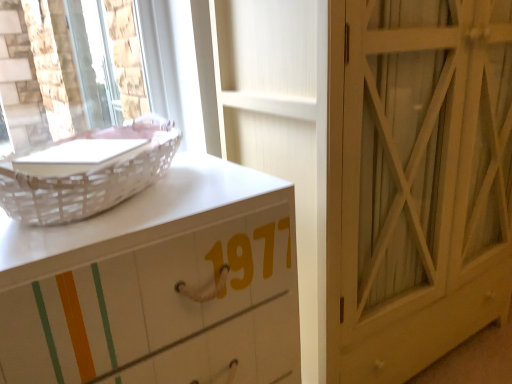
Question: Is white wood door at center-right looking in the opposite direction of white painted wood chest of drawers at left?

Choices:
 (A) yes
 (B) no

Answer: (B)

Question: Is white wood door at center-right smaller than white painted wood chest of drawers at left?

Choices:
 (A) yes
 (B) no

Answer: (B)

Question: Can you confirm if white wood door at center-right is shorter than white painted wood chest of drawers at left?

Choices:
 (A) no
 (B) yes

Answer: (A)

Question: Does white wood door at center-right have a larger size compared to white painted wood chest of drawers at left?

Choices:
 (A) no
 (B) yes

Answer: (B)

Question: Can you see white wood door at center-right touching white painted wood chest of drawers at left?

Choices:
 (A) yes
 (B) no

Answer: (B)

Question: Is white wood door at center-right wider or thinner than white painted wood chest of drawers at left?

Choices:
 (A) wide
 (B) thin

Answer: (A)

Question: From the image's perspective, relative to white painted wood chest of drawers at left, is white wood door at center-right above or below?

Choices:
 (A) below
 (B) above

Answer: (B)

Question: In terms of height, does white wood door at center-right look taller or shorter compared to white painted wood chest of drawers at left?

Choices:
 (A) short
 (B) tall

Answer: (B)

Question: Is white wood door at center-right situated inside white painted wood chest of drawers at left or outside?

Choices:
 (A) inside
 (B) outside

Answer: (B)

Question: From the image's perspective, is white wicker basket at upper left above or below white wood door at center-right?

Choices:
 (A) below
 (B) above

Answer: (B)

Question: Is white wicker basket at upper left in front of or behind white wood door at center-right in the image?

Choices:
 (A) front
 (B) behind

Answer: (A)

Question: Considering the relative positions of white wicker basket at upper left and white wood door at center-right in the image provided, is white wicker basket at upper left to the left or to the right of white wood door at center-right?

Choices:
 (A) left
 (B) right

Answer: (A)

Question: Looking at their shapes, would you say white wicker basket at upper left is wider or thinner than white wood door at center-right?

Choices:
 (A) wide
 (B) thin

Answer: (B)

Question: Is white painted wood chest of drawers at left inside the boundaries of white wood door at center-right, or outside?

Choices:
 (A) inside
 (B) outside

Answer: (B)

Question: In terms of width, does white painted wood chest of drawers at left look wider or thinner when compared to white wood door at center-right?

Choices:
 (A) wide
 (B) thin

Answer: (B)